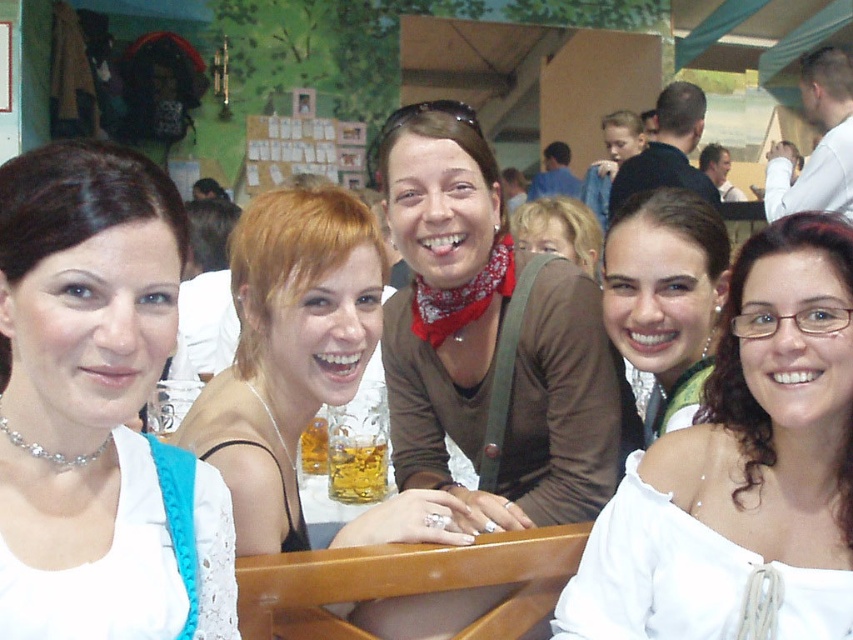
You are standing at the origin point of the image. Which of the two points, point (654, 372) or point (299, 442), is closer to you?

Point (654, 372) is closer to you because it is in front of point (299, 442).

You are a photographer at the event and want to ensure that both the white satin dress at center and the translucent glass cup at center are clearly visible in your photo. Given that your camera has a focus range of 3 feet, can you capture both objects in sharp focus without moving the camera?

The white satin dress at center and the translucent glass cup at center are 3.47 feet apart from each other. Since the distance between them exceeds the camera focus range of 3 feet, the photographer cannot capture both in sharp focus without adjusting the camera settings or moving the camera to reposition.

You are standing at the point marked as point [641,554] in the image. The image shows a lively social gathering at a beer festival with a traditional Bavarian backdrop. You want to take a step forward. Is the distance from your current position to the viewer sufficient to move forward without bumping into anything?

The distance of point [641,554] from viewer is 4.71 feet, which is enough space to take a step forward safely.